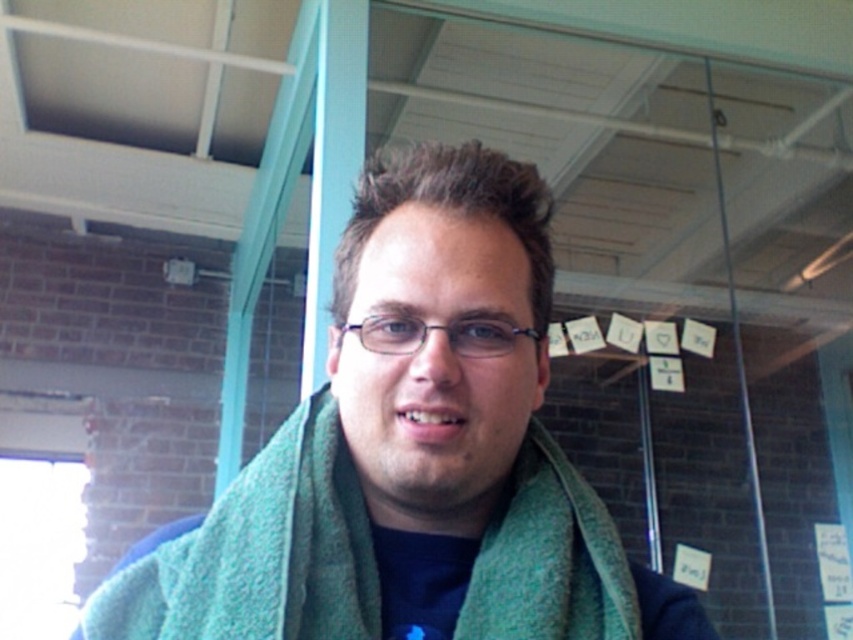
You are standing in a casual indoor setting with a brick wall and glass partition. You see a green wool scarf at center. Can you reach out and touch it without moving your feet?

The green wool scarf at center is 15.09 inches away from the viewer, so yes, you can reach out and touch it without moving your feet since the distance is within typical arm reach.

You are a tailor measuring two green scarves in the image. The first is labeled as a green wool scarf at center, and the second is a green woolen scarf at center. The customer wants to know if there is enough space between them to place a 4 cm wide ribbon. Can you confirm?

The green wool scarf at center and green woolen scarf at center are 3.49 centimeters apart from each other. Since the distance between them is less than 4 cm, the ribbon cannot fit between them.